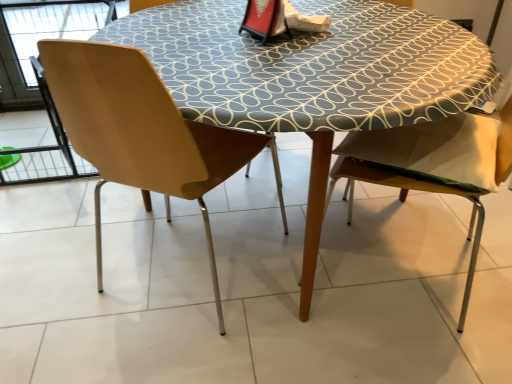
Question: Considering the relative positions of wooden chair at right, the 2th chair when ordered from left to right, and matte wood chair at left, arranged as the 1th chair when viewed from the left, in the image provided, is wooden chair at right, the 2th chair when ordered from left to right, to the left of matte wood chair at left, arranged as the 1th chair when viewed from the left, from the viewer's perspective?

Choices:
 (A) yes
 (B) no

Answer: (B)

Question: Is wooden chair at right, the 2th chair when ordered from left to right, oriented away from matte wood chair at left, arranged as the second chair when viewed from the right?

Choices:
 (A) yes
 (B) no

Answer: (B)

Question: From a real-world perspective, is wooden chair at right, which is the 1th chair from right to left, on top of matte wood chair at left, arranged as the second chair when viewed from the right?

Choices:
 (A) yes
 (B) no

Answer: (B)

Question: Is matte wood chair at left, arranged as the 1th chair when viewed from the left, located within wooden chair at right, which is the 1th chair from right to left?

Choices:
 (A) no
 (B) yes

Answer: (A)

Question: Is the position of wooden chair at right, which is the 1th chair from right to left, more distant than that of matte wood chair at left, arranged as the second chair when viewed from the right?

Choices:
 (A) yes
 (B) no

Answer: (B)

Question: From a real-world perspective, is matte wood chair at left, arranged as the second chair when viewed from the right, positioned above or below wooden chair at right, the 2th chair when ordered from left to right?

Choices:
 (A) below
 (B) above

Answer: (B)

Question: Is matte wood chair at left, arranged as the second chair when viewed from the right, to the left or to the right of wooden chair at right, the 2th chair when ordered from left to right, in the image?

Choices:
 (A) right
 (B) left

Answer: (B)

Question: Considering the positions of matte wood chair at left, arranged as the 1th chair when viewed from the left, and wooden chair at right, which is the 1th chair from right to left, in the image, is matte wood chair at left, arranged as the 1th chair when viewed from the left, wider or thinner than wooden chair at right, which is the 1th chair from right to left,?

Choices:
 (A) thin
 (B) wide

Answer: (A)

Question: Considering the positions of matte wood chair at left, arranged as the second chair when viewed from the right, and wooden chair at right, which is the 1th chair from right to left, in the image, is matte wood chair at left, arranged as the second chair when viewed from the right, bigger or smaller than wooden chair at right, which is the 1th chair from right to left,?

Choices:
 (A) small
 (B) big

Answer: (A)

Question: Considering the positions of wooden chair at right, the 2th chair when ordered from left to right, and matte wood chair at left, arranged as the 1th chair when viewed from the left, in the image, is wooden chair at right, the 2th chair when ordered from left to right, wider or thinner than matte wood chair at left, arranged as the 1th chair when viewed from the left,?

Choices:
 (A) thin
 (B) wide

Answer: (B)

Question: Relative to matte wood chair at left, arranged as the 1th chair when viewed from the left, is wooden chair at right, the 2th chair when ordered from left to right, in front or behind?

Choices:
 (A) front
 (B) behind

Answer: (A)

Question: Is wooden chair at right, which is the 1th chair from right to left, spatially inside matte wood chair at left, arranged as the second chair when viewed from the right, or outside of it?

Choices:
 (A) outside
 (B) inside

Answer: (A)

Question: Based on their sizes in the image, would you say wooden chair at right, the 2th chair when ordered from left to right, is bigger or smaller than matte wood chair at left, arranged as the second chair when viewed from the right?

Choices:
 (A) small
 (B) big

Answer: (B)

Question: In terms of width, does wooden chair at right, the 2th chair when ordered from left to right, look wider or thinner when compared to wooden table at center?

Choices:
 (A) wide
 (B) thin

Answer: (B)

Question: Is point (458, 190) positioned closer to the camera than point (165, 38)?

Choices:
 (A) closer
 (B) farther

Answer: (A)